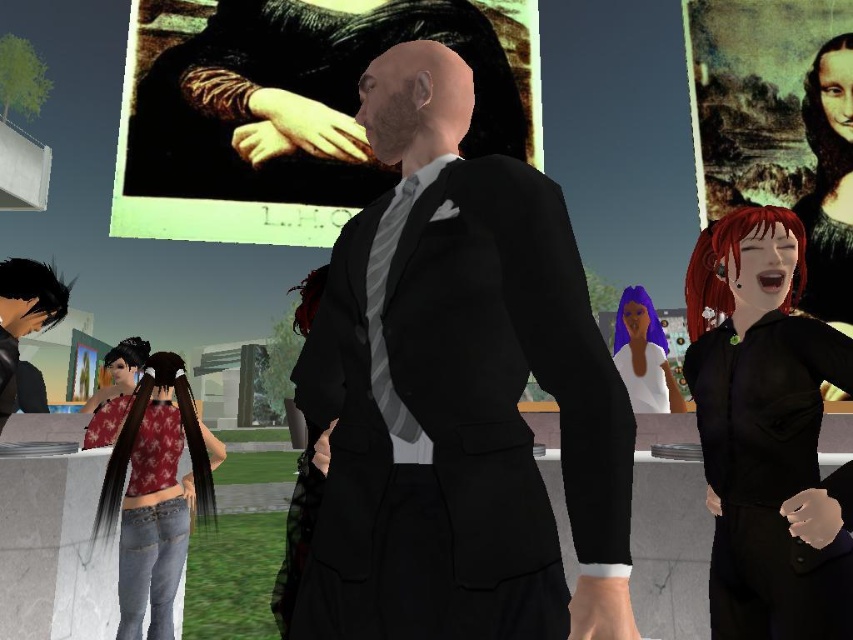
Question: Does matte black suit at center have a greater width compared to shiny black hair at left?

Choices:
 (A) no
 (B) yes

Answer: (A)

Question: Considering the real-world distances, which object is farthest from the matte black painting at upper center?

Choices:
 (A) shiny black shirt at right
 (B) matte red shirt at lower left
 (C) matte purple hair at center

Answer: (A)

Question: Does denim jeans at lower left appear on the left side of shiny black hair at left?

Choices:
 (A) no
 (B) yes

Answer: (A)

Question: Among these points, which one is nearest to the camera?

Choices:
 (A) (122, 392)
 (B) (525, 276)
 (C) (183, 100)

Answer: (B)

Question: Is matte black suit at center smaller than matte purple hair at center?

Choices:
 (A) no
 (B) yes

Answer: (B)

Question: Which point is farther from the camera taking this photo?

Choices:
 (A) (450, 605)
 (B) (392, 184)

Answer: (B)